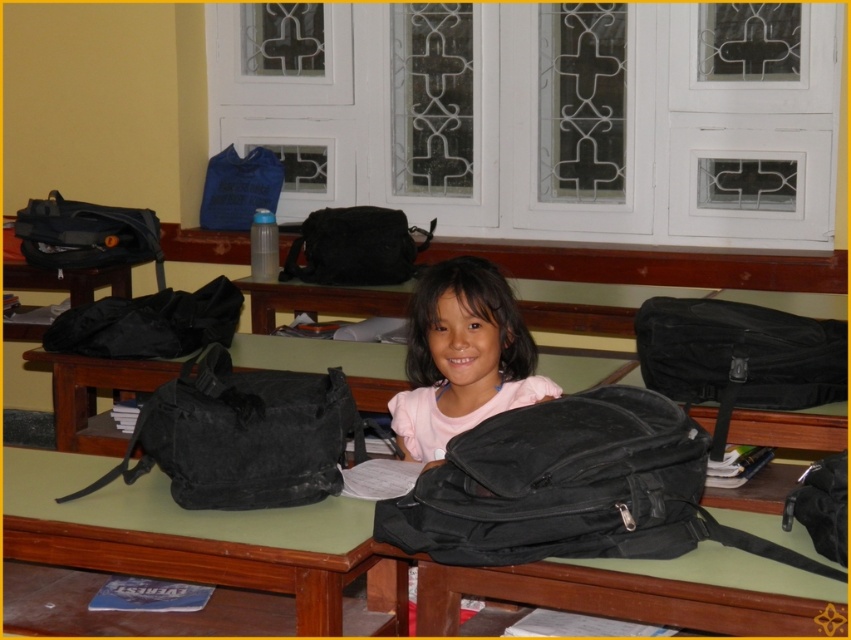
From the picture: You are a student who needs to place a new book on the bench between the black matte backpack at lower center and the pink matte backpack at center. If your book is 12 inches thick, will there be enough space between them?

The black matte backpack at lower center is 26.16 inches from the pink matte backpack at center. Since the book is only 12 inches thick, there is sufficient space between them to place the book.

You are a student trying to reach your pink matte backpack at center from where you are sitting. There is a black matte backpack at lower center in the way. Can you easily reach your backpack without moving the black one?

The black matte backpack at lower center is closer to the viewer than the pink matte backpack at center, so it is blocking the direct path. You would need to move the black matte backpack at lower center to access the pink matte backpack at center.